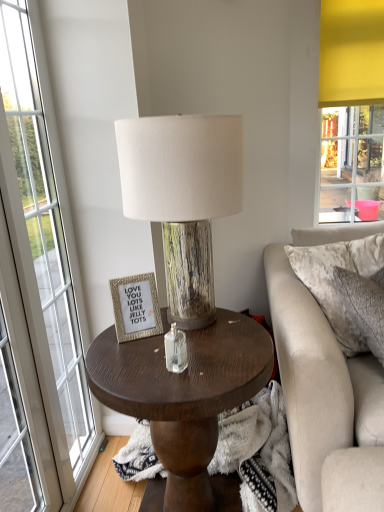
Question: Looking at the image, does gold textured picture frame at upper center seem bigger or smaller compared to velvet beige pillow at right?

Choices:
 (A) small
 (B) big

Answer: (A)

Question: From a real-world perspective, is gold textured picture frame at upper center positioned above or below velvet beige pillow at right?

Choices:
 (A) below
 (B) above

Answer: (B)

Question: Which object is positioned farthest from the wood grain lampshade at center?

Choices:
 (A) dark wood coffee table at center
 (B) gold textured picture frame at upper center
 (C) transparent glass window at left
 (D) velvet beige pillow at right

Answer: (D)

Question: Considering the real-world distances, which object is farthest from the velvet beige pillow at right?

Choices:
 (A) dark wood coffee table at center
 (B) gold textured picture frame at upper center
 (C) transparent glass window at left
 (D) wood grain lampshade at center

Answer: (C)